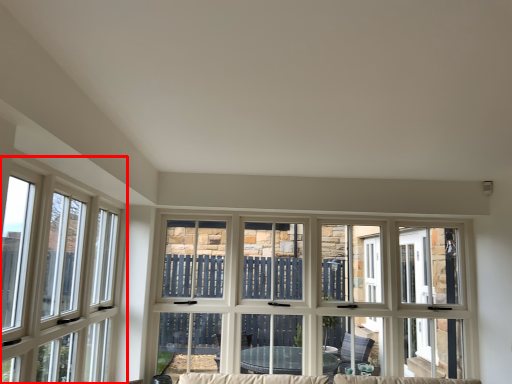
Question: In this image, where is window (annotated by the red box) located relative to window?

Choices:
 (A) left
 (B) right

Answer: (A)